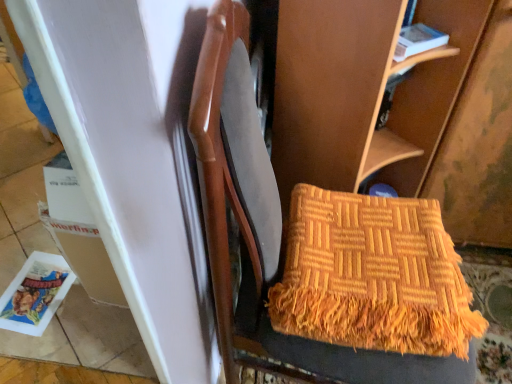
Question: Based on their sizes in the image, would you say matte plastic magazine at lower left, the 2th magazine in the front-to-back sequence, is bigger or smaller than white paper magazine at upper right, arranged as the first magazine when viewed from the top?

Choices:
 (A) big
 (B) small

Answer: (A)

Question: Based on their positions, is matte plastic magazine at lower left, which appears as the first magazine when viewed from the back, located to the left or right of white paper magazine at upper right, which ranks as the first magazine in right-to-left order?

Choices:
 (A) right
 (B) left

Answer: (B)

Question: Considering the real-world distances, which object is closest to the orange woven blanket at center?

Choices:
 (A) matte plastic magazine at lower left, the 2th magazine in the front-to-back sequence
 (B) white paper magazine at upper right, which ranks as the first magazine in right-to-left order

Answer: (B)

Question: Which of these objects is positioned closest to the white paper magazine at upper right, the 1th magazine viewed from the front?

Choices:
 (A) matte plastic magazine at lower left, which is the 1th magazine in bottom-to-top order
 (B) orange woven blanket at center

Answer: (B)